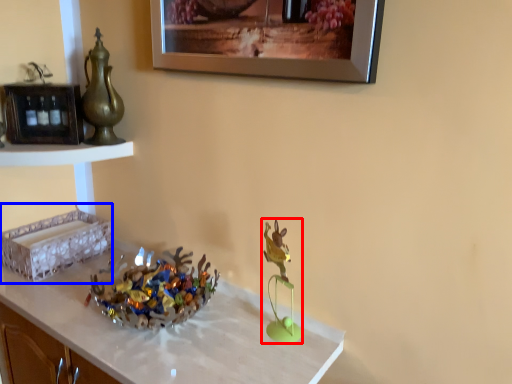
Question: Which object appears farthest to the camera in this image, toy (highlighted by a red box) or shelf (highlighted by a blue box)?

Choices:
 (A) toy
 (B) shelf

Answer: (B)